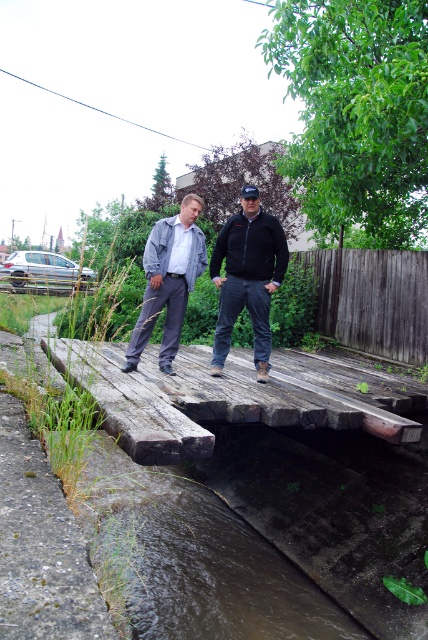
You are a delivery person carrying a heavy box and need to cross the bridge. Considering the weathered wood bridge at center and the brown concrete stream at lower center, which one is higher and safer to step on?

The weathered wood bridge at center has a greater height compared to the brown concrete stream at lower center, so it is higher and safer to step on.

You are a photographer trying to capture the entire scene of the brown concrete stream at lower center and the matte black jacket at center in one shot. Based on their sizes, which object should you focus on first to ensure both are in frame?

The brown concrete stream at lower center is larger in size than the matte black jacket at center, so you should focus on the brown concrete stream at lower center first to ensure both fit in the frame.

You are standing on the wooden bridge and want to take a photo of the brown concrete stream at lower center. If your camera can focus on objects up to 5 meters away, will it be able to capture the stream clearly?

The brown concrete stream at lower center is 4.23 meters away from the camera, which is within the 5 meters focusing range. Therefore, the camera should be able to capture the stream clearly.